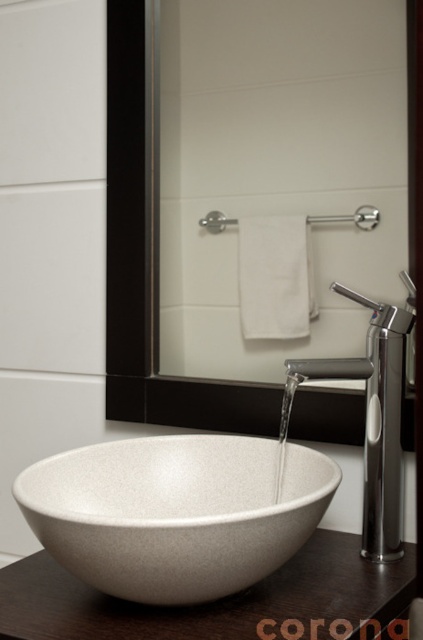
Is white matte towel at upper center smaller than silver metallic towel bar at upper center?

Incorrect, white matte towel at upper center is not smaller in size than silver metallic towel bar at upper center.

Who is positioned more to the left, white matte towel at upper center or silver metallic towel bar at upper center?

white matte towel at upper center is more to the left.

What do you see at coordinates (277, 164) in the screenshot? The width and height of the screenshot is (423, 640). I see `white matte towel at upper center` at bounding box center [277, 164].

This screenshot has width=423, height=640. What are the coordinates of `white matte towel at upper center` in the screenshot? It's located at click(277, 164).

Who is taller, white matte towel at upper center or polished metallic faucet at center?

With more height is white matte towel at upper center.

Does white matte towel at upper center appear on the right side of polished metallic faucet at center?

Incorrect, white matte towel at upper center is not on the right side of polished metallic faucet at center.

Is point (351, 36) positioned in front of point (362, 532)?

No, it is not.

Locate an element on the screen. The height and width of the screenshot is (640, 423). white matte towel at upper center is located at coordinates point(277,164).

Between point (142, 481) and point (312, 216), which one is positioned in front?

Point (142, 481)

Can you confirm if white speckled stone sink at center is positioned to the left of silver metallic towel bar at upper center?

Correct, you'll find white speckled stone sink at center to the left of silver metallic towel bar at upper center.

Who is more distant from viewer, (197, 480) or (233, 225)?

Positioned behind is point (233, 225).

Where is `white speckled stone sink at center`? Image resolution: width=423 pixels, height=640 pixels. white speckled stone sink at center is located at coordinates pyautogui.click(x=175, y=513).